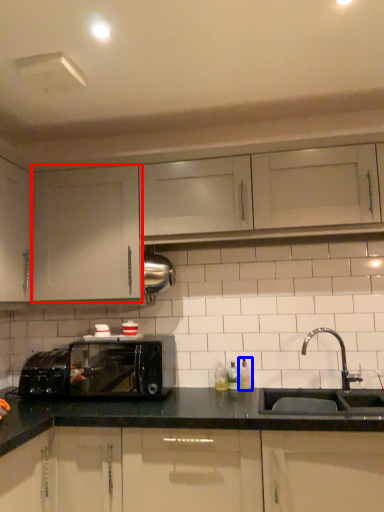
Question: Which object is closer to the camera taking this photo, cabinetry (highlighted by a red box) or bottle (highlighted by a blue box)?

Choices:
 (A) cabinetry
 (B) bottle

Answer: (A)